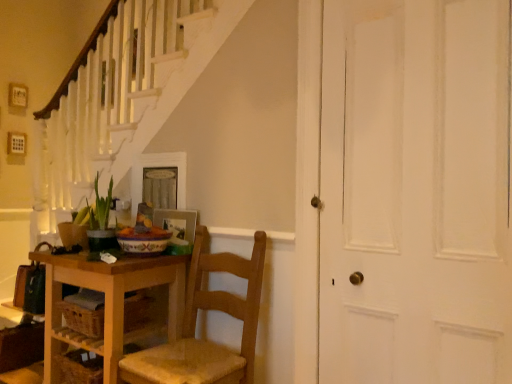
Question: From a real-world perspective, is white matte door at right under wooden table at lower left?

Choices:
 (A) yes
 (B) no

Answer: (B)

Question: Is white matte door at right not close to wooden table at lower left?

Choices:
 (A) no
 (B) yes

Answer: (B)

Question: Is white matte door at right facing towards wooden table at lower left?

Choices:
 (A) no
 (B) yes

Answer: (A)

Question: Does white matte door at right have a larger size compared to wooden table at lower left?

Choices:
 (A) no
 (B) yes

Answer: (A)

Question: Is white matte door at right thinner than wooden table at lower left?

Choices:
 (A) yes
 (B) no

Answer: (A)

Question: Is white matte door at right at the right side of wooden table at lower left?

Choices:
 (A) no
 (B) yes

Answer: (B)

Question: From a real-world perspective, is white matte door at right beneath wooden drawer at lower left?

Choices:
 (A) yes
 (B) no

Answer: (B)

Question: Is white matte door at right taller than wooden drawer at lower left?

Choices:
 (A) yes
 (B) no

Answer: (A)

Question: Is wooden drawer at lower left inside white matte door at right?

Choices:
 (A) yes
 (B) no

Answer: (B)

Question: Is white matte door at right positioned in front of wooden drawer at lower left?

Choices:
 (A) yes
 (B) no

Answer: (A)

Question: Could you tell me if white matte door at right is turned towards wooden drawer at lower left?

Choices:
 (A) no
 (B) yes

Answer: (A)

Question: Is white matte door at right outside wooden drawer at lower left?

Choices:
 (A) no
 (B) yes

Answer: (B)

Question: Is wooden picture frame at center, the 1th picture frame in the bottom-to-top sequence, completely or partially outside of wooden drawer at lower left?

Choices:
 (A) yes
 (B) no

Answer: (A)